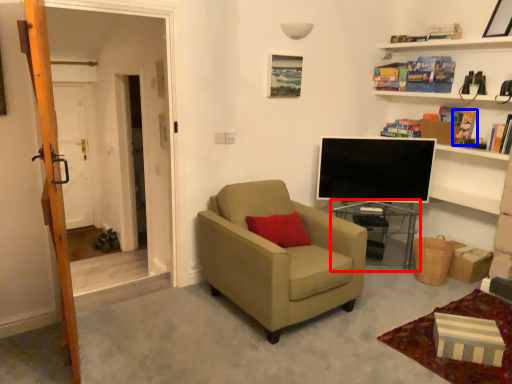
Question: Which of the following is the farthest to the observer, table (highlighted by a red box) or book (highlighted by a blue box)?

Choices:
 (A) table
 (B) book

Answer: (A)